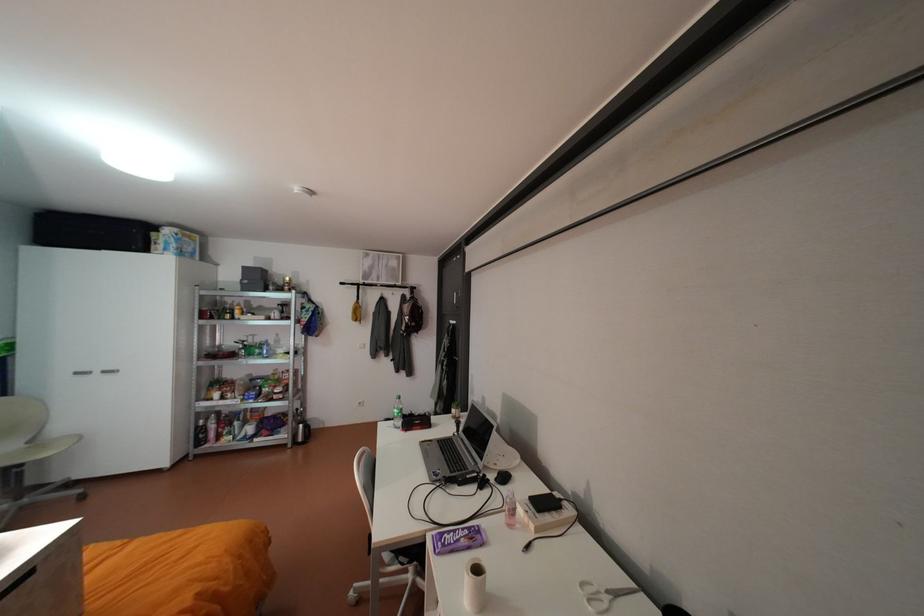
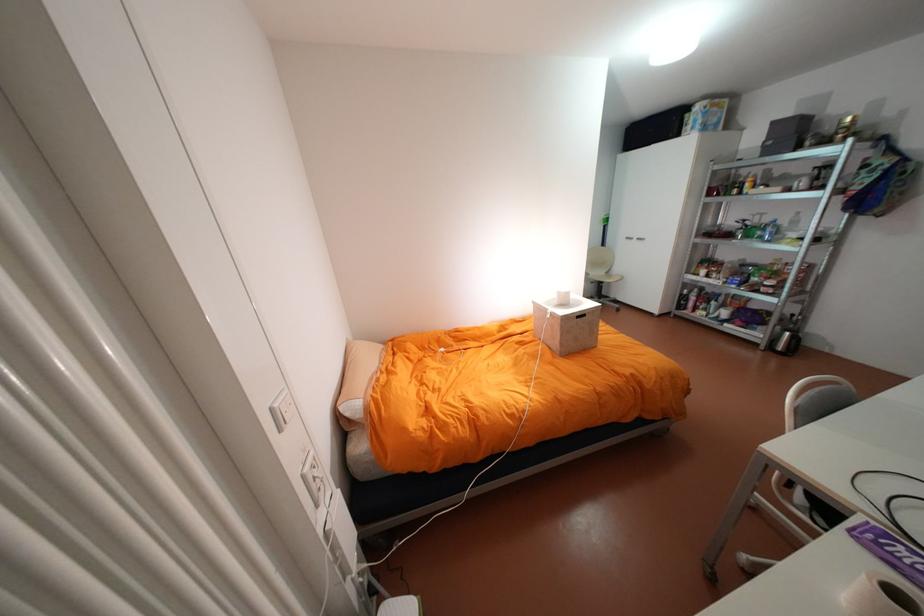
The point at (266, 339) is marked in the first image. Where is the corresponding point in the second image?

(775, 219)